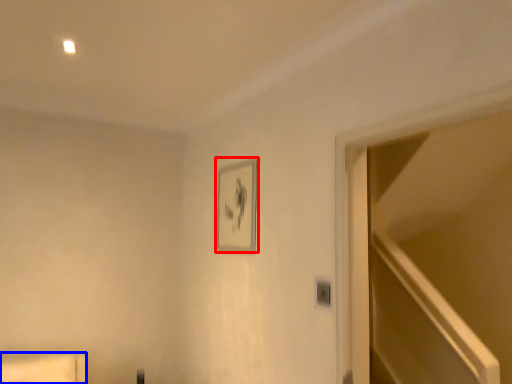
Question: Among these objects, which one is farthest to the camera, picture frame (highlighted by a red box) or furniture (highlighted by a blue box)?

Choices:
 (A) picture frame
 (B) furniture

Answer: (A)